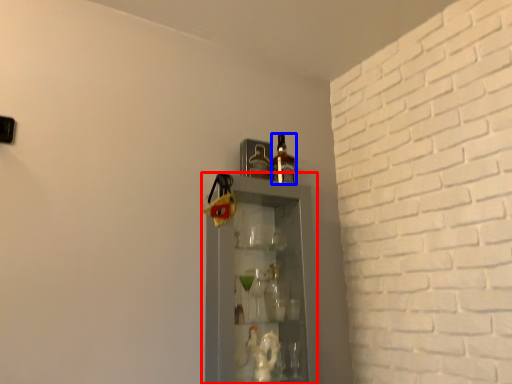
Question: Which point is closer to the camera, shelf (highlighted by a red box) or bottle (highlighted by a blue box)?

Choices:
 (A) shelf
 (B) bottle

Answer: (A)